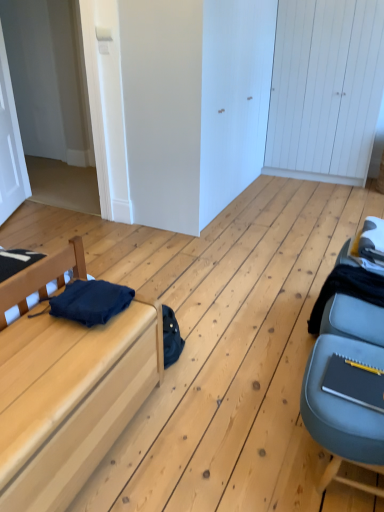
The height and width of the screenshot is (512, 384). What are the coordinates of `free space in front of dark blue fabric at left, which is the 1th clothing from left to right` in the screenshot? It's located at (58, 350).